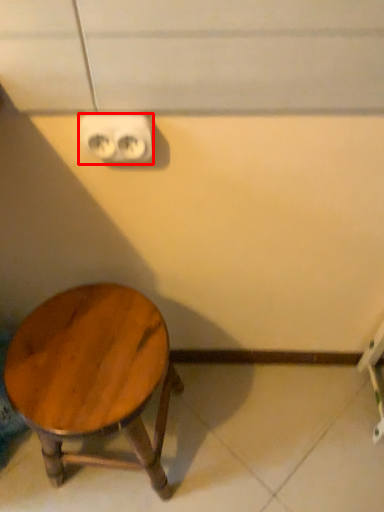
Question: From the image, what is the correct spatial relationship of electric outlet (annotated by the red box) in relation to stool?

Choices:
 (A) left
 (B) right

Answer: (B)